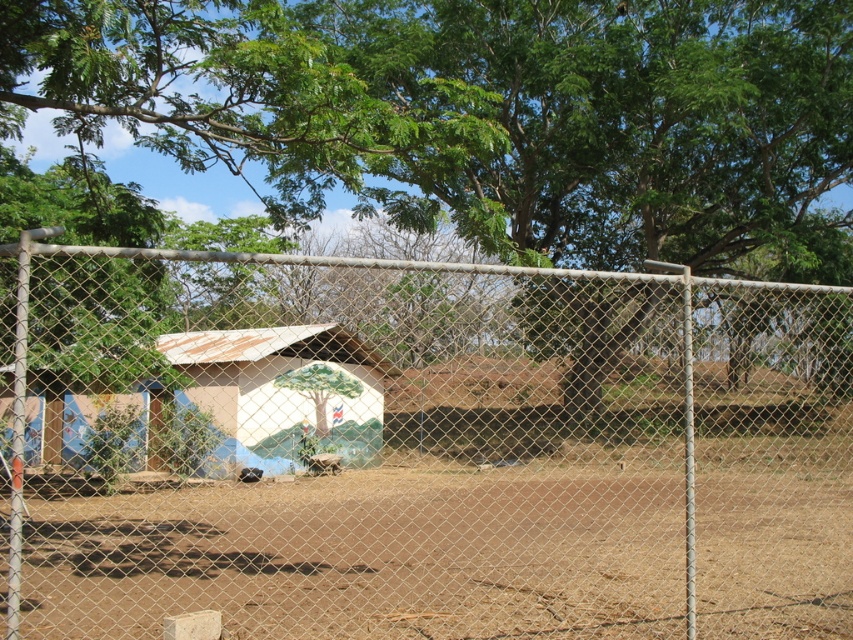
You are standing in front of the fence and see a point marked at coordinates (418, 449). Based on the scene description, where exactly is this point located?

The point is on the metal mesh fence at center.

You are standing outside the fence looking at the scene. Which object is closer to you between the green leafy tree at upper center and the brown dirt field at center?

The green leafy tree at upper center is closer to you because the brown dirt field at center is behind it.

You are a photographer standing in front of the metal mesh fence at center. You want to take a photo of the green leafy tree at upper center without the fence blocking the view. Is it possible to move to a position where the fence is no longer in front of the tree?

The metal mesh fence at center is positioned under the green leafy tree at upper center, so if you move to a position where you can look above the fence, the tree will be visible without obstruction.